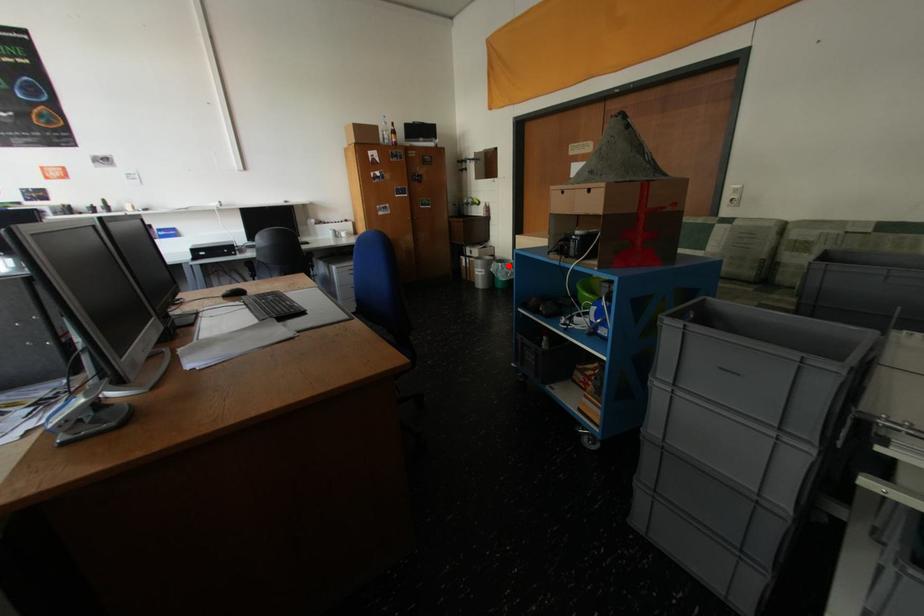
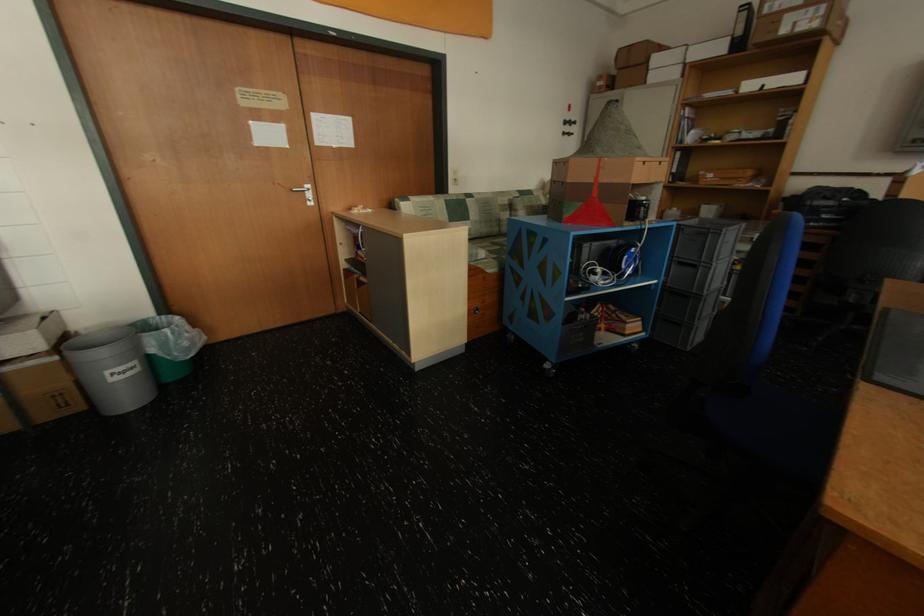
Question: I am providing you with two images of the same scene from different viewpoints. A red point is shown in image1. For the corresponding object point in image2, is it positioned nearer or farther from the camera?

Choices:
 (A) Nearer
 (B) Farther

Answer: (B)